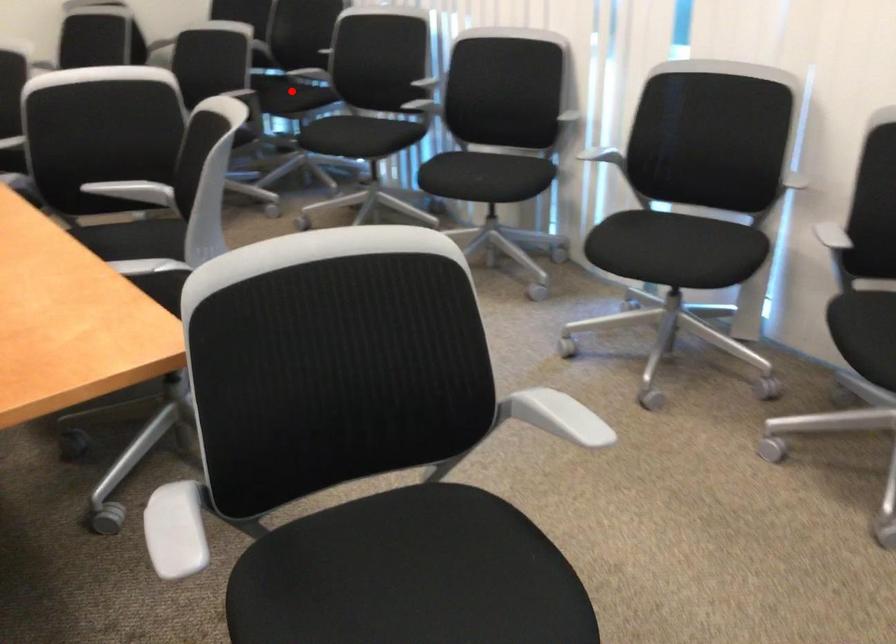
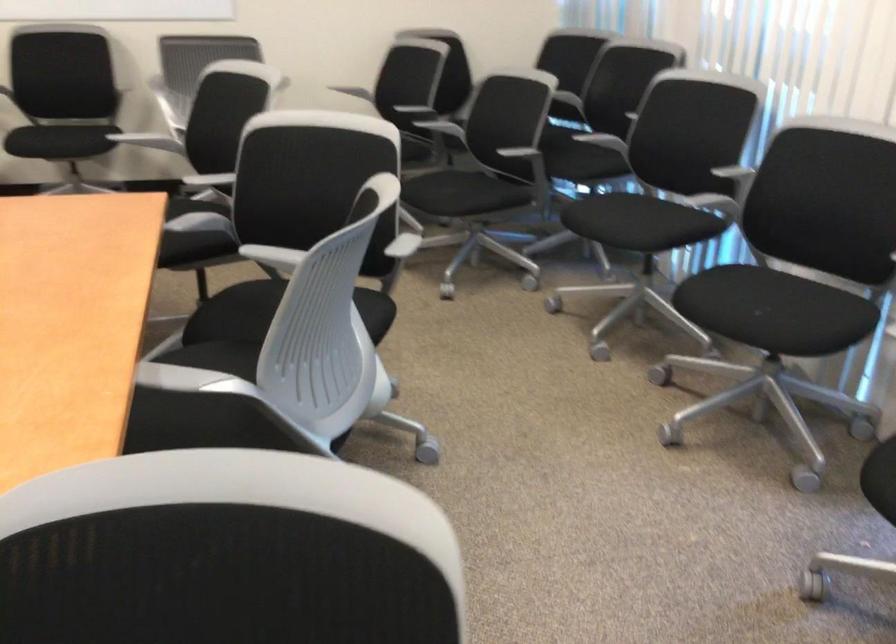
Question: I am providing you with two images of the same scene from different viewpoints. Image1 has a red point marked. In image2, the corresponding 3D location appears at what relative position? Reply with the corresponding letter.

Choices:
 (A) Closer
 (B) Farther

Answer: (A)